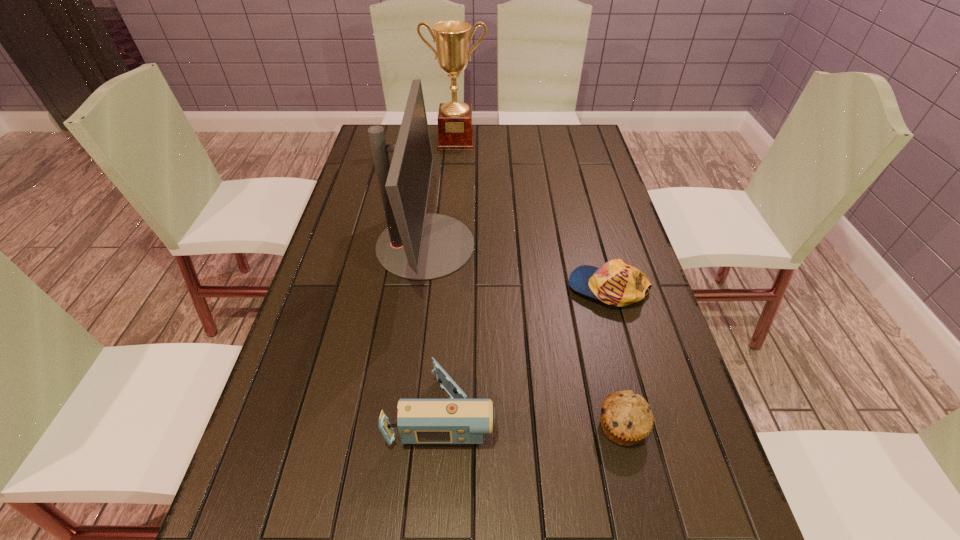
This screenshot has width=960, height=540. Identify the location of trophy cup. (452, 39).

This screenshot has width=960, height=540. In order to click on computer monitor in this screenshot , I will do `click(416, 245)`.

The image size is (960, 540). Identify the location of camcorder. (459, 420).

Find the location of a particular element. The width and height of the screenshot is (960, 540). cap is located at coordinates (617, 283).

At what (x,y) coordinates should I click in order to perform the action: click on muffin. Please return your answer as a coordinate pair (x, y). The width and height of the screenshot is (960, 540). Looking at the image, I should click on (626, 418).

Locate an element on the screen. This screenshot has height=540, width=960. free space located 0.390m on the plaque of the trophy cup is located at coordinates (451, 215).

The width and height of the screenshot is (960, 540). I want to click on free region located on the screen of the computer monitor, so click(548, 245).

Image resolution: width=960 pixels, height=540 pixels. What are the coordinates of `vacant region located on the side of the camcorder with the flip-out screen` in the screenshot? It's located at (564, 411).

Image resolution: width=960 pixels, height=540 pixels. I want to click on vacant area situated on the bill of the cap, so click(507, 288).

You are a GUI agent. You are given a task and a screenshot of the screen. Output one action in this format:
    pyautogui.click(x=<x>, y=<y>)
    Task: Click on the free point located on the bill of the cap
    
    Given the screenshot: What is the action you would take?
    pyautogui.click(x=468, y=288)